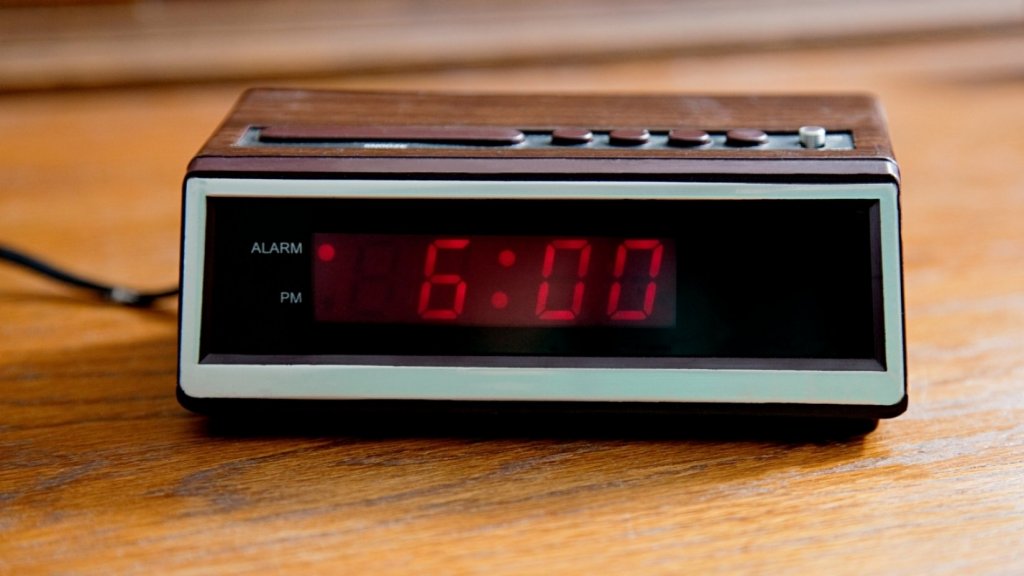
Image resolution: width=1024 pixels, height=576 pixels. In order to click on black electrical power cord coming out of the back of the alarm clock on the left in this screenshot , I will do `click(91, 284)`.